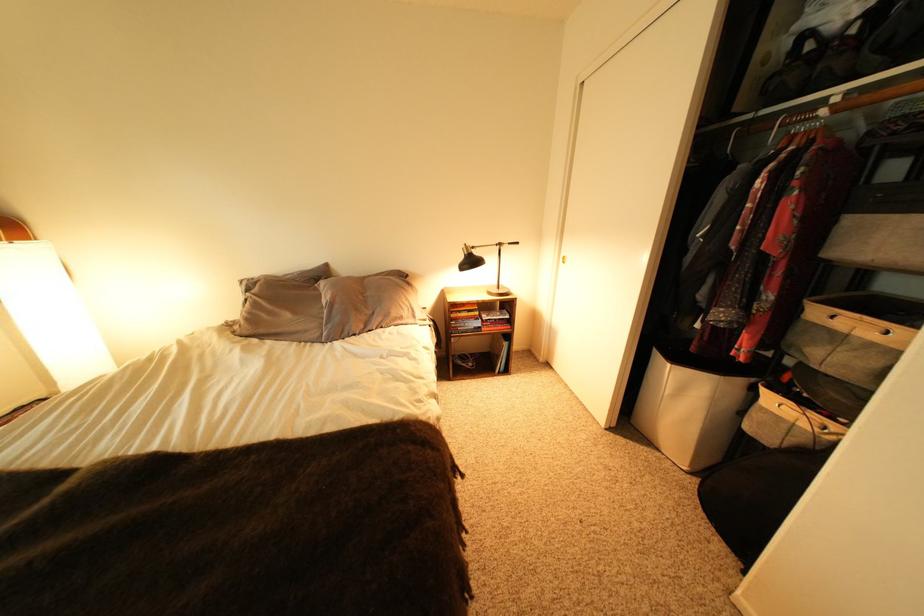
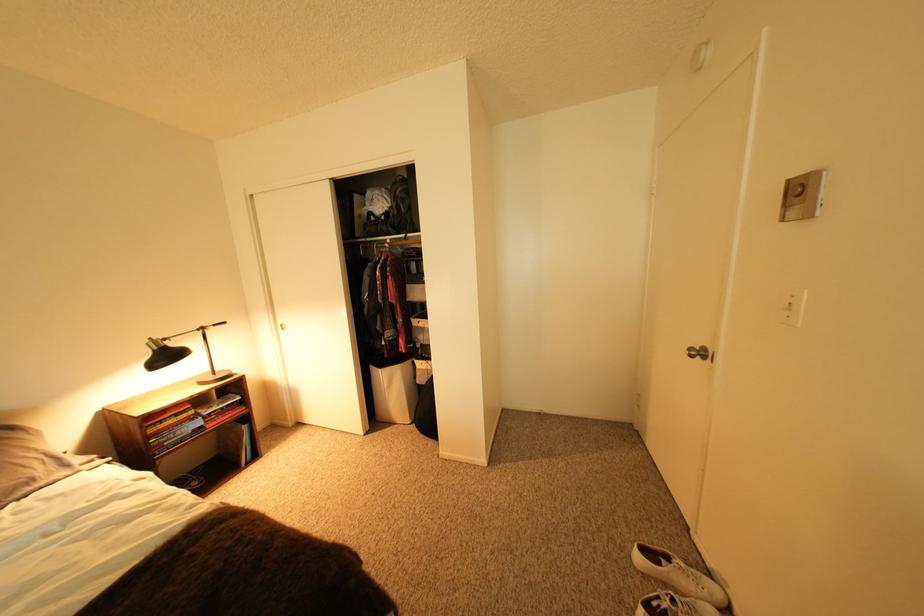
Find the pixel in the second image that matches [682,367] in the first image.

(393, 371)